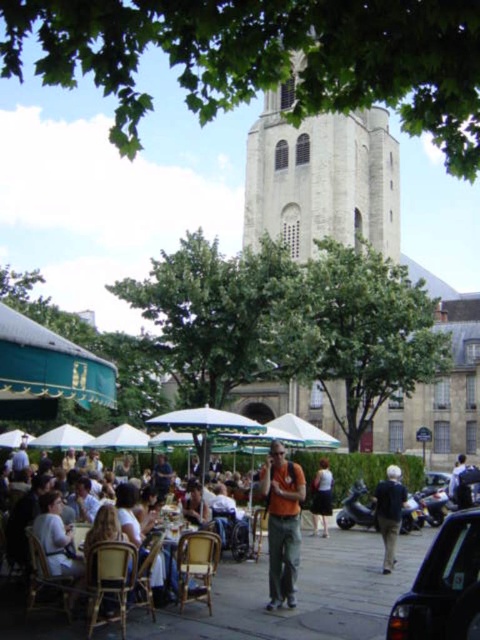
Is point (457, 588) in front of point (168, 570)?

Yes.

Between point (475, 582) and point (165, 532), which one is positioned in front?

Point (475, 582)

The image size is (480, 640). Find the location of `black glossy car at lower right`. black glossy car at lower right is located at coordinates (444, 586).

Does green canvas canopy at left appear on the right side of orange fabric shirt at center?

Incorrect, green canvas canopy at left is not on the right side of orange fabric shirt at center.

Which is in front, point (9, 394) or point (292, 541)?

Point (292, 541) is more forward.

Identify the location of green canvas canopy at left. This screenshot has width=480, height=640. tap(48, 365).

Which is in front, point (36, 387) or point (204, 420)?

Point (36, 387) is more forward.

Which is behind, point (52, 346) or point (220, 420)?

The point (220, 420) is behind.

This screenshot has height=640, width=480. Find the location of `green canvas canopy at left`. green canvas canopy at left is located at coordinates [x=48, y=365].